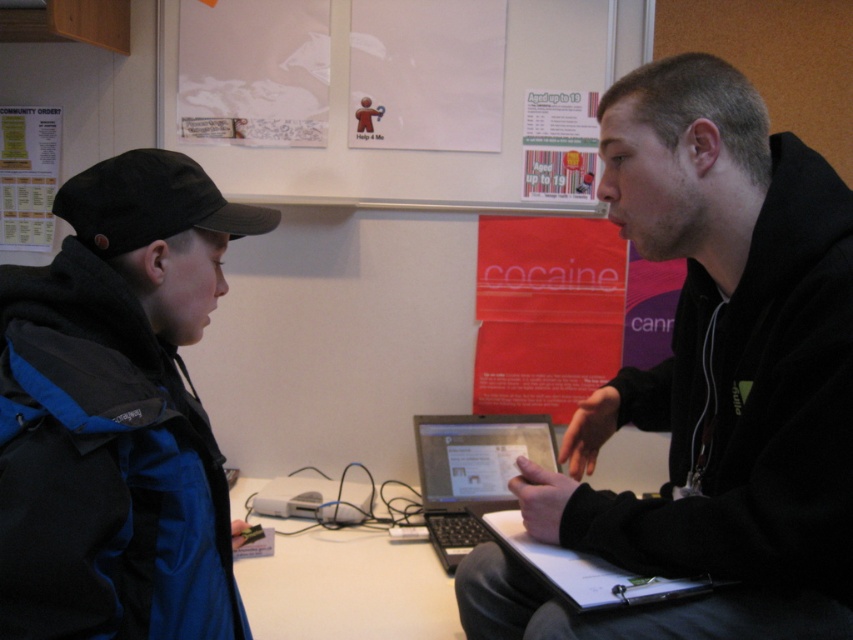
You are a delivery person who needs to place a small package at the exact location of point [426,74]. The scene has a white paper at upper center located at that point. Where should you place the package?

Place the package at the white paper at upper center since it is located at point [426,74].

You are a delivery robot with a package that needs to be placed between the black matte jacket at center and the blue fabric jacket at left. The package is 20 inches long. Can you fit the package between them without moving either jacket?

The distance between the black matte jacket at center and the blue fabric jacket at left is 19.89 inches. Since the package is 20 inches long, it is slightly longer than the available space. Therefore, the package cannot fit between them without moving either jacket.

You are a visitor in the room and want to read the text on both the white paper at upper center and the white paper poster at upper left. Which one should you move closer to first to read them in order from left to right?

You should first move closer to the white paper poster at upper left because it is positioned to the left of the white paper at upper center, following the left to right order.